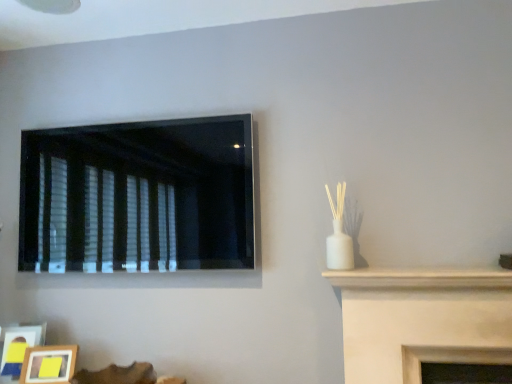
Where is `wooden photo frame at lower left, acting as the 1th picture frame starting from the right`? This screenshot has width=512, height=384. wooden photo frame at lower left, acting as the 1th picture frame starting from the right is located at coordinates (49, 364).

The height and width of the screenshot is (384, 512). What do you see at coordinates (138, 196) in the screenshot?
I see `black matte window at upper left` at bounding box center [138, 196].

Describe the element at coordinates (18, 345) in the screenshot. Image resolution: width=512 pixels, height=384 pixels. I see `wooden picture frame at lower left, which ranks as the 2th picture frame in right-to-left order` at that location.

Locate an element on the screen. This screenshot has height=384, width=512. wooden photo frame at lower left, the second picture frame when ordered from left to right is located at coordinates (49, 364).

Is wooden picture frame at lower left, the 1th picture frame in the left-to-right sequence, not within black matte window at upper left?

Yes, wooden picture frame at lower left, the 1th picture frame in the left-to-right sequence, is not within black matte window at upper left.

Considering the sizes of wooden picture frame at lower left, which ranks as the 2th picture frame in right-to-left order, and black matte window at upper left in the image, is wooden picture frame at lower left, which ranks as the 2th picture frame in right-to-left order, bigger or smaller than black matte window at upper left?

Considering their sizes, wooden picture frame at lower left, which ranks as the 2th picture frame in right-to-left order, takes up less space than black matte window at upper left.

Considering the relative positions of wooden picture frame at lower left, which ranks as the 2th picture frame in right-to-left order, and black matte window at upper left in the image provided, is wooden picture frame at lower left, which ranks as the 2th picture frame in right-to-left order, behind black matte window at upper left?

Yes, it is behind black matte window at upper left.

How distant is black matte window at upper left from wooden photo frame at lower left, acting as the 1th picture frame starting from the right?

black matte window at upper left is 66.62 centimeters from wooden photo frame at lower left, acting as the 1th picture frame starting from the right.

Is black matte window at upper left facing towards wooden photo frame at lower left, the second picture frame when ordered from left to right?

No, black matte window at upper left is not turned towards wooden photo frame at lower left, the second picture frame when ordered from left to right.

Based on the photo, from a real-world perspective, between black matte window at upper left and wooden photo frame at lower left, the second picture frame when ordered from left to right, who is vertically lower?

wooden photo frame at lower left, the second picture frame when ordered from left to right, is physically lower.

How different are the orientations of black matte window at upper left and wooden photo frame at lower left, acting as the 1th picture frame starting from the right, in degrees?

The facing directions of black matte window at upper left and wooden photo frame at lower left, acting as the 1th picture frame starting from the right, are 19.1 degrees apart.

From a real-world perspective, who is located higher, wooden photo frame at lower left, acting as the 1th picture frame starting from the right, or black matte window at upper left?

black matte window at upper left, from a real-world perspective.

Is wooden photo frame at lower left, acting as the 1th picture frame starting from the right, positioned with its back to black matte window at upper left?

No, wooden photo frame at lower left, acting as the 1th picture frame starting from the right, is not facing the opposite direction of black matte window at upper left.

The width and height of the screenshot is (512, 384). Identify the location of the 1st picture frame counting from the left side of the black matte window at upper left. (49, 364).

Between wooden photo frame at lower left, acting as the 1th picture frame starting from the right, and black matte window at upper left, which one has more height?

black matte window at upper left.

Where is `the 1st picture frame located beneath the black matte window at upper left (from a real-world perspective)`? This screenshot has height=384, width=512. the 1st picture frame located beneath the black matte window at upper left (from a real-world perspective) is located at coordinates (18, 345).

From a real-world perspective, who is located lower, black matte window at upper left or wooden picture frame at lower left, the 1th picture frame in the left-to-right sequence?

From a 3D spatial view, wooden picture frame at lower left, the 1th picture frame in the left-to-right sequence, is below.

Is black matte window at upper left taller than wooden picture frame at lower left, the 1th picture frame in the left-to-right sequence?

Indeed, black matte window at upper left has a greater height compared to wooden picture frame at lower left, the 1th picture frame in the left-to-right sequence.

Is wooden photo frame at lower left, acting as the 1th picture frame starting from the right, at the left side of wooden picture frame at lower left, the 1th picture frame in the left-to-right sequence?

In fact, wooden photo frame at lower left, acting as the 1th picture frame starting from the right, is to the right of wooden picture frame at lower left, the 1th picture frame in the left-to-right sequence.

How far apart are wooden photo frame at lower left, the second picture frame when ordered from left to right, and wooden picture frame at lower left, the 1th picture frame in the left-to-right sequence?

wooden photo frame at lower left, the second picture frame when ordered from left to right, and wooden picture frame at lower left, the 1th picture frame in the left-to-right sequence, are 3.56 inches apart from each other.

Is wooden photo frame at lower left, the second picture frame when ordered from left to right, not within wooden picture frame at lower left, the 1th picture frame in the left-to-right sequence?

Yes.

Looking at this image, how different are the orientations of wooden photo frame at lower left, the second picture frame when ordered from left to right, and wooden picture frame at lower left, which ranks as the 2th picture frame in right-to-left order, in degrees?

0.728 degrees separate the facing orientations of wooden photo frame at lower left, the second picture frame when ordered from left to right, and wooden picture frame at lower left, which ranks as the 2th picture frame in right-to-left order.

From a real-world perspective, is wooden picture frame at lower left, the 1th picture frame in the left-to-right sequence, under wooden photo frame at lower left, acting as the 1th picture frame starting from the right?

No, from a real-world perspective, wooden picture frame at lower left, the 1th picture frame in the left-to-right sequence, is not below wooden photo frame at lower left, acting as the 1th picture frame starting from the right.

Is wooden picture frame at lower left, the 1th picture frame in the left-to-right sequence, surrounding wooden photo frame at lower left, the second picture frame when ordered from left to right?

Definitely not — wooden photo frame at lower left, the second picture frame when ordered from left to right, is not inside wooden picture frame at lower left, the 1th picture frame in the left-to-right sequence.

The height and width of the screenshot is (384, 512). What are the coordinates of `picture frame lying on the left of wooden photo frame at lower left, the second picture frame when ordered from left to right` in the screenshot? It's located at (18, 345).

Is wooden picture frame at lower left, which ranks as the 2th picture frame in right-to-left order, aimed at wooden photo frame at lower left, the second picture frame when ordered from left to right?

No, wooden picture frame at lower left, which ranks as the 2th picture frame in right-to-left order, is not turned towards wooden photo frame at lower left, the second picture frame when ordered from left to right.

Where is `window that appears on the right of wooden picture frame at lower left, which ranks as the 2th picture frame in right-to-left order`? This screenshot has height=384, width=512. window that appears on the right of wooden picture frame at lower left, which ranks as the 2th picture frame in right-to-left order is located at coordinates (138, 196).

In order to click on window in front of the wooden photo frame at lower left, the second picture frame when ordered from left to right in this screenshot , I will do `click(138, 196)`.

When comparing their distances from wooden picture frame at lower left, which ranks as the 2th picture frame in right-to-left order, does black matte window at upper left or wooden photo frame at lower left, acting as the 1th picture frame starting from the right, seem closer?

wooden photo frame at lower left, acting as the 1th picture frame starting from the right, is closer to wooden picture frame at lower left, which ranks as the 2th picture frame in right-to-left order.

When comparing their distances from wooden photo frame at lower left, the second picture frame when ordered from left to right, does wooden picture frame at lower left, the 1th picture frame in the left-to-right sequence, or black matte window at upper left seem closer?

The object closer to wooden photo frame at lower left, the second picture frame when ordered from left to right, is wooden picture frame at lower left, the 1th picture frame in the left-to-right sequence.

From the image, which object appears to be farther from wooden picture frame at lower left, which ranks as the 2th picture frame in right-to-left order, wooden photo frame at lower left, the second picture frame when ordered from left to right, or black matte window at upper left?

black matte window at upper left lies further to wooden picture frame at lower left, which ranks as the 2th picture frame in right-to-left order, than the other object.

From the image, which object appears to be nearer to wooden photo frame at lower left, the second picture frame when ordered from left to right, black matte window at upper left or wooden picture frame at lower left, which ranks as the 2th picture frame in right-to-left order?

The object closer to wooden photo frame at lower left, the second picture frame when ordered from left to right, is wooden picture frame at lower left, which ranks as the 2th picture frame in right-to-left order.

Considering their positions, is wooden photo frame at lower left, acting as the 1th picture frame starting from the right, positioned closer to black matte window at upper left than wooden picture frame at lower left, which ranks as the 2th picture frame in right-to-left order?

Among the two, wooden photo frame at lower left, acting as the 1th picture frame starting from the right, is located nearer to black matte window at upper left.

Considering their positions, is wooden picture frame at lower left, which ranks as the 2th picture frame in right-to-left order, positioned closer to black matte window at upper left than wooden photo frame at lower left, acting as the 1th picture frame starting from the right?

wooden photo frame at lower left, acting as the 1th picture frame starting from the right, is positioned closer to the anchor black matte window at upper left.

Find the location of `picture frame between black matte window at upper left and wooden photo frame at lower left, acting as the 1th picture frame starting from the right, vertically`. picture frame between black matte window at upper left and wooden photo frame at lower left, acting as the 1th picture frame starting from the right, vertically is located at coordinates (18, 345).